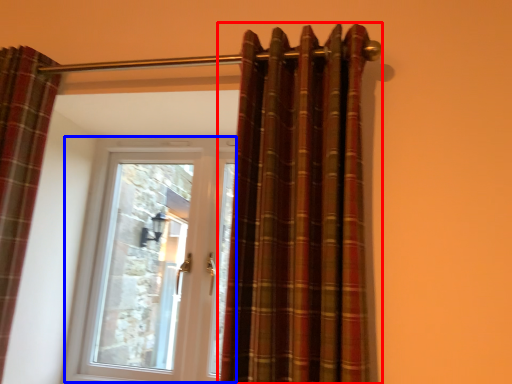
Question: Which point is closer to the camera, curtain (highlighted by a red box) or door (highlighted by a blue box)?

Choices:
 (A) curtain
 (B) door

Answer: (A)